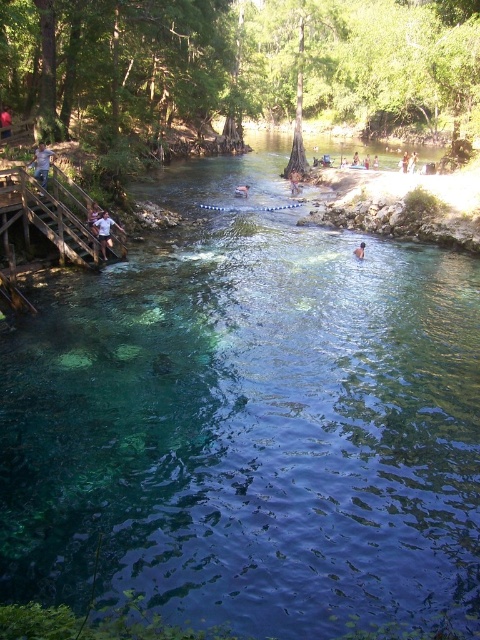
Question: Which object appears farthest from the camera in this image?

Choices:
 (A) white cotton shirt at upper center
 (B) brown hair at center
 (C) light blue denim jeans at left

Answer: (B)

Question: Can you confirm if light blue denim jeans at left is positioned below red shirt at left?

Choices:
 (A) yes
 (B) no

Answer: (A)

Question: Which point is closer to the camera?

Choices:
 (A) (237, 189)
 (B) (101, 225)
 (C) (35, 160)

Answer: (C)

Question: In this image, where is brown leather jacket at center located relative to brown hair at center?

Choices:
 (A) above
 (B) below

Answer: (A)

Question: Estimate the real-world distances between objects in this image. Which object is farther from the brown leather jacket at center?

Choices:
 (A) light blue denim jeans at left
 (B) red shirt at left
 (C) smooth skin person at center

Answer: (A)

Question: In this image, where is light blue denim jeans at left located relative to brown hair at center?

Choices:
 (A) left
 (B) right

Answer: (A)